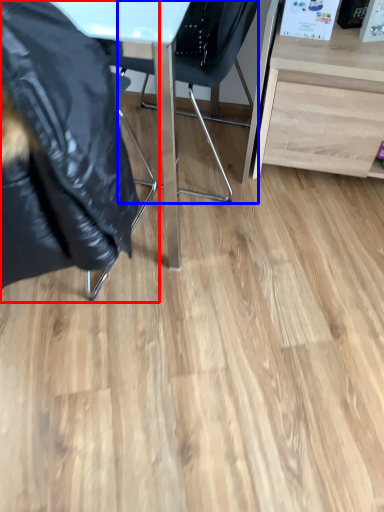
Question: Which of the following is the closest to the observer, chair (highlighted by a red box) or chair (highlighted by a blue box)?

Choices:
 (A) chair
 (B) chair

Answer: (A)